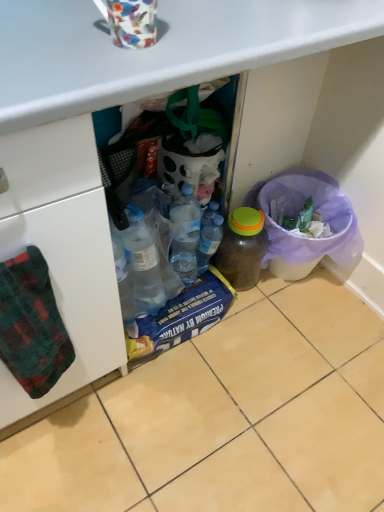
Locate an element on the screen. The height and width of the screenshot is (512, 384). free space behind floral-patterned ceramic mug at upper center is located at coordinates pyautogui.click(x=169, y=10).